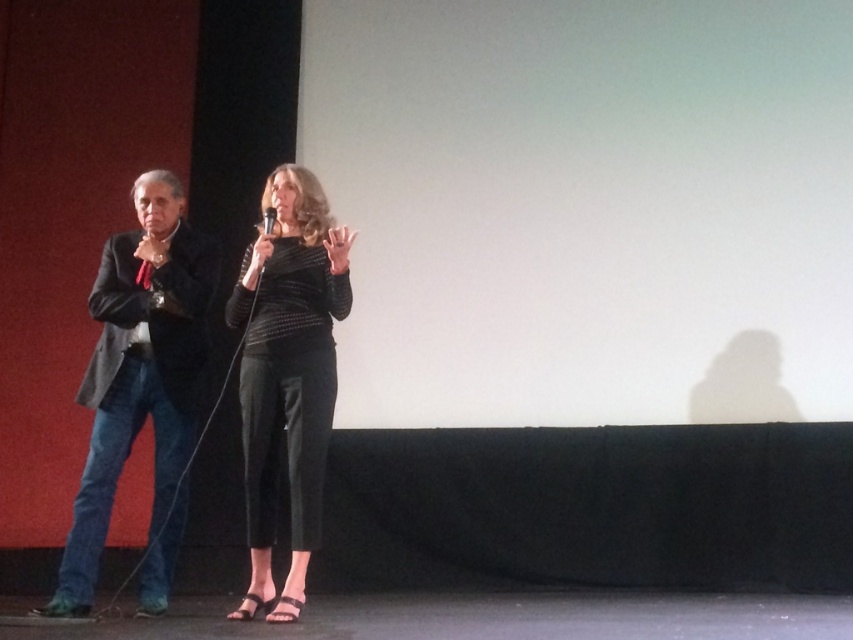
Does black textured pants at center appear under black matte microphone at center?

Yes.

How distant is black textured pants at center from black matte microphone at center?

black textured pants at center is 21.23 inches from black matte microphone at center.

Does point (254, 280) come in front of point (265, 220)?

Yes, point (254, 280) is in front of point (265, 220).

Image resolution: width=853 pixels, height=640 pixels. Identify the location of black textured pants at center. (288, 374).

The height and width of the screenshot is (640, 853). I want to click on dark gray suit at left, so click(x=140, y=385).

Looking at this image, is dark gray suit at left taller than black matte microphone at center?

Yes, dark gray suit at left is taller than black matte microphone at center.

What do you see at coordinates (140, 385) in the screenshot?
I see `dark gray suit at left` at bounding box center [140, 385].

Locate an element on the screen. The image size is (853, 640). dark gray suit at left is located at coordinates (140, 385).

Is dark gray suit at left further to camera compared to black textured pants at center?

Yes, it is.

Who is lower down, dark gray suit at left or black textured pants at center?

dark gray suit at left is lower down.

Which is in front, point (90, 381) or point (291, 268)?

Point (291, 268) is in front.

The height and width of the screenshot is (640, 853). I want to click on dark gray suit at left, so click(140, 385).